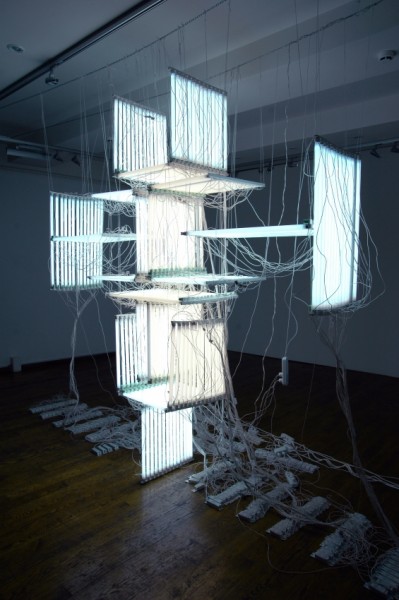
Find the location of a particular element. wood floor is located at coordinates (166, 532).